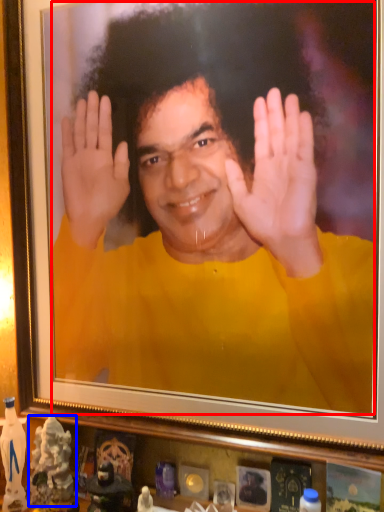
Question: Which object appears farthest to the camera in this image, man (highlighted by a red box) or toy (highlighted by a blue box)?

Choices:
 (A) man
 (B) toy

Answer: (B)